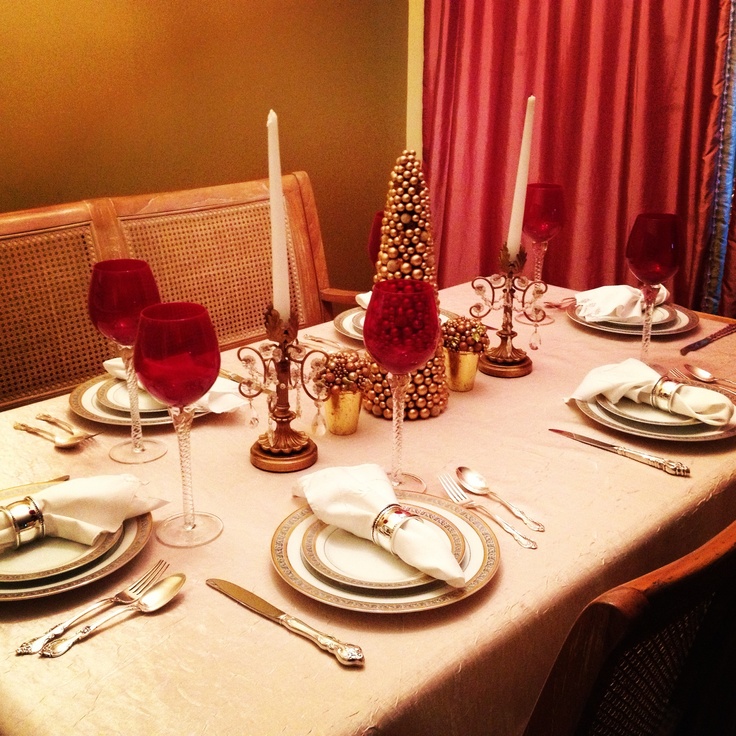
Find the location of a particular element. This screenshot has width=736, height=736. napkin rings is located at coordinates (392, 512), (17, 517), (656, 297), (664, 383).